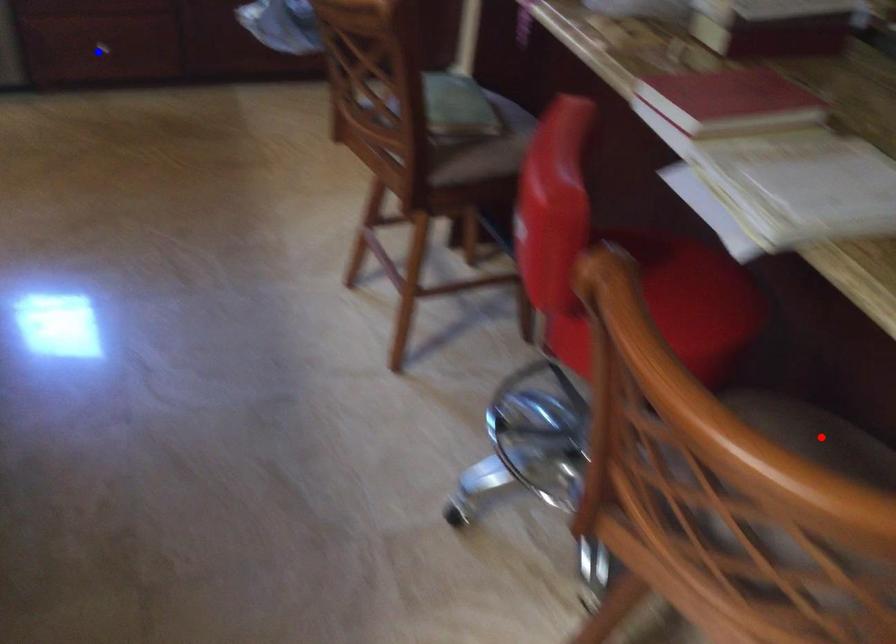
Question: Two points are marked on the image. Which point is closer to the camera?

Choices:
 (A) Blue point is closer.
 (B) Red point is closer.

Answer: (B)